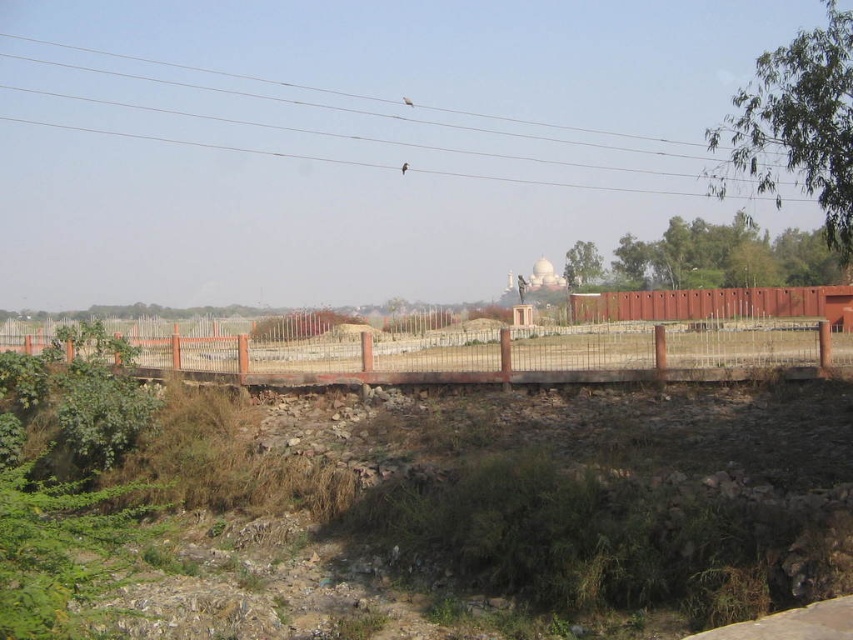
Is orange metal fence at center bigger than brick wall at center?

Incorrect, orange metal fence at center is not larger than brick wall at center.

Who is taller, orange metal fence at center or brick wall at center?

brick wall at center

Find the location of `orange metal fence at center`. orange metal fence at center is located at coordinates [x=519, y=353].

Is smooth wire at upper center positioned behind brick wall at center?

No, smooth wire at upper center is in front of brick wall at center.

Does smooth wire at upper center appear over brick wall at center?

Correct, smooth wire at upper center is located above brick wall at center.

Who is more distant from viewer, (99, 100) or (584, 304)?

The point (99, 100) is more distant.

Locate an element on the screen. Image resolution: width=853 pixels, height=640 pixels. smooth wire at upper center is located at coordinates (352, 109).

Does orange metal fence at center appear on the left side of smooth wire at upper center?

No, orange metal fence at center is not to the left of smooth wire at upper center.

Between orange metal fence at center and smooth wire at upper center, which one appears on the left side from the viewer's perspective?

smooth wire at upper center is more to the left.

Between point (547, 362) and point (694, 147), which one is positioned behind?

Positioned behind is point (694, 147).

Find the location of a particular element. The height and width of the screenshot is (640, 853). orange metal fence at center is located at coordinates (519, 353).